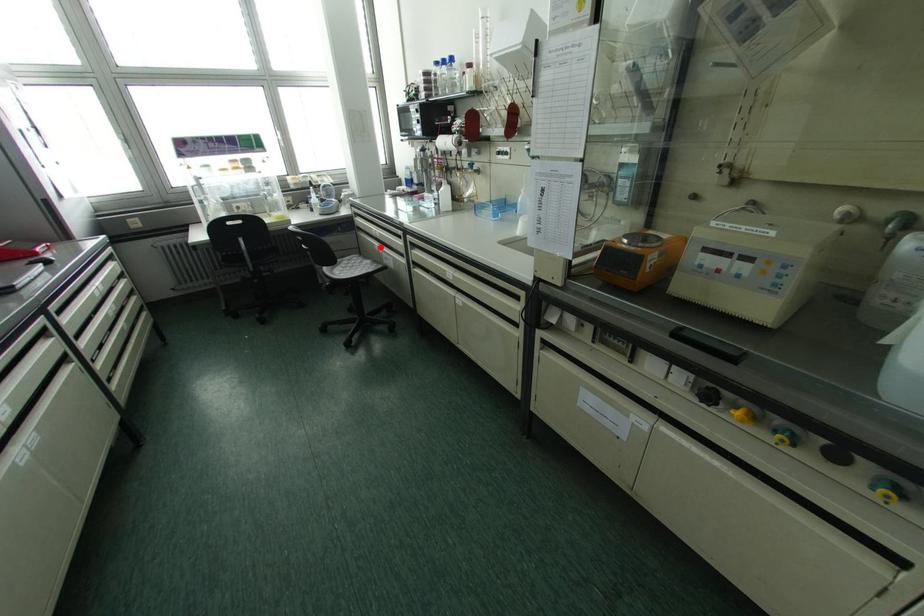
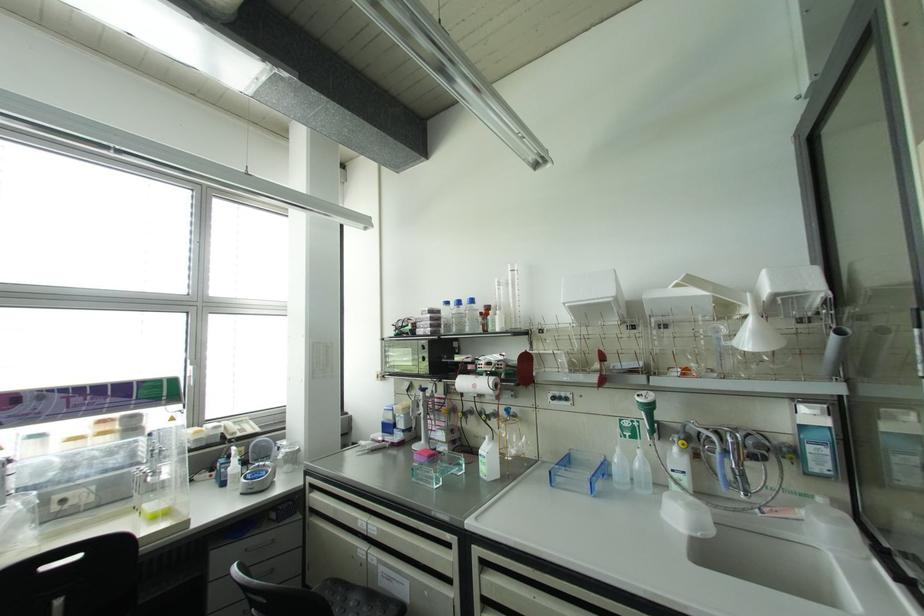
The point at the highlighted location is marked in the first image. Where is the corresponding point in the second image?

(373, 554)